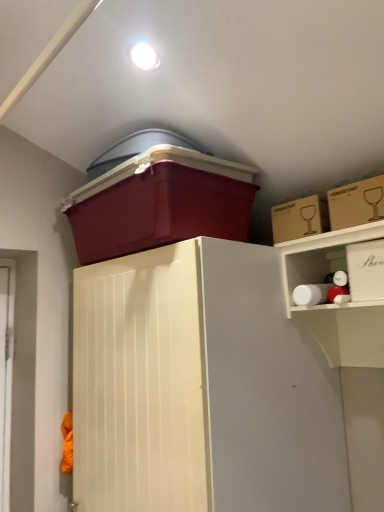
Question: Does cardboard box at upper right, marked as the second storage box in a left-to-right arrangement, have a greater height compared to cardboard box at upper right, placed as the second storage box when sorted from right to left?

Choices:
 (A) no
 (B) yes

Answer: (A)

Question: From a real-world perspective, is cardboard box at upper right, which ranks as the third storage box in right-to-left order, beneath cardboard box at upper right, placed as the second storage box when sorted from right to left?

Choices:
 (A) no
 (B) yes

Answer: (A)

Question: Can you confirm if cardboard box at upper right, marked as the second storage box in a left-to-right arrangement, is positioned to the right of cardboard box at upper right, placed as the second storage box when sorted from right to left?

Choices:
 (A) yes
 (B) no

Answer: (B)

Question: Is cardboard box at upper right, which ranks as the third storage box in right-to-left order, smaller than cardboard box at upper right, placed as the second storage box when sorted from right to left?

Choices:
 (A) no
 (B) yes

Answer: (A)

Question: From a real-world perspective, is cardboard box at upper right, marked as the second storage box in a left-to-right arrangement, positioned over cardboard box at upper right, placed as the second storage box when sorted from right to left, based on gravity?

Choices:
 (A) no
 (B) yes

Answer: (B)

Question: Is cardboard box at upper right, marked as the second storage box in a left-to-right arrangement, shorter than cardboard box at upper right, placed as the second storage box when sorted from right to left?

Choices:
 (A) no
 (B) yes

Answer: (B)

Question: Considering the relative sizes of matte plastic storage box at upper center, arranged as the first storage box when viewed from the left, and cardboard box at upper right, which is counted as the 3th storage box, starting from the left, in the image provided, is matte plastic storage box at upper center, arranged as the first storage box when viewed from the left, wider than cardboard box at upper right, which is counted as the 3th storage box, starting from the left,?

Choices:
 (A) no
 (B) yes

Answer: (B)

Question: Could you tell me if matte plastic storage box at upper center, arranged as the first storage box when viewed from the left, is facing cardboard box at upper right, placed as the second storage box when sorted from right to left?

Choices:
 (A) no
 (B) yes

Answer: (A)

Question: From a real-world perspective, is matte plastic storage box at upper center, the fourth storage box when ordered from right to left, located higher than cardboard box at upper right, placed as the second storage box when sorted from right to left?

Choices:
 (A) no
 (B) yes

Answer: (B)

Question: Is matte plastic storage box at upper center, the fourth storage box when ordered from right to left, surrounding cardboard box at upper right, which is counted as the 3th storage box, starting from the left?

Choices:
 (A) no
 (B) yes

Answer: (A)

Question: Is matte plastic storage box at upper center, the fourth storage box when ordered from right to left, with cardboard box at upper right, which is counted as the 3th storage box, starting from the left?

Choices:
 (A) no
 (B) yes

Answer: (A)

Question: From the image's perspective, is matte plastic storage box at upper center, the fourth storage box when ordered from right to left, on top of cardboard box at upper right, placed as the second storage box when sorted from right to left?

Choices:
 (A) yes
 (B) no

Answer: (B)

Question: Does cardboard box at upper right, which is counted as the 3th storage box, starting from the left, appear on the right side of white cardboard box at upper right, which ranks as the 4th storage box in left-to-right order?

Choices:
 (A) no
 (B) yes

Answer: (A)